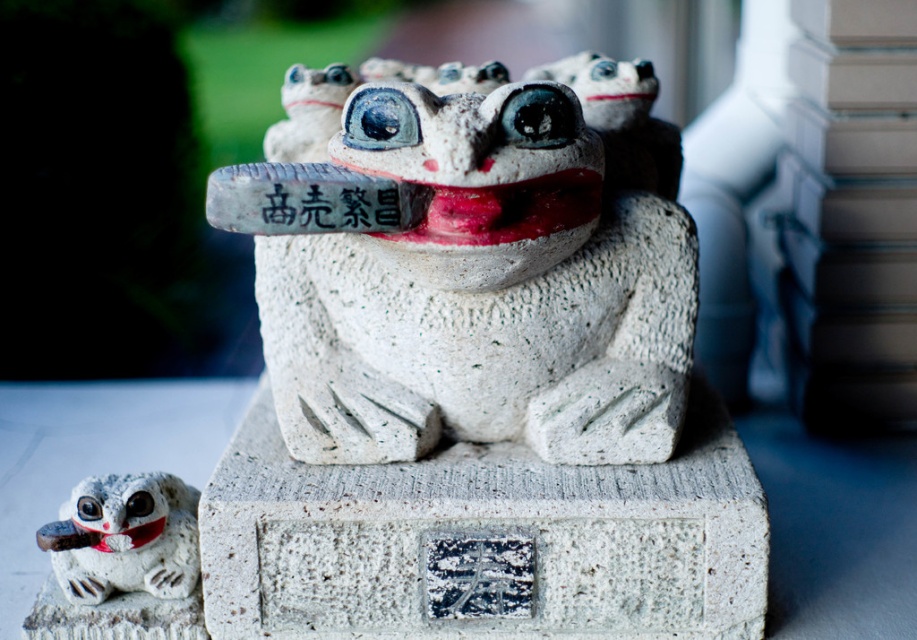
You are an art curator planning to display both the white stone frog at center and the white stone frog at lower left in a new exhibition. Which frog should be placed closer to the entrance to ensure visitors notice its larger size first?

The white stone frog at center should be placed closer to the entrance because it is larger in size than the white stone frog at lower left, making it more noticeable to visitors upon entry.

You are standing in front of the main frog statue and want to place a small bird figurine between the white stone frog at center and the white stone frog at lower left. Can you do this without the bird being blocked from view by either frog?

The white stone frog at center is closer to the viewer than the white stone frog at lower left. Therefore, placing the bird between them would require positioning it behind the closer frog, which would block the view. Alternatively, placing it in front of the closer frog might not be possible due to the frog being in front. Hence, the bird figurine would likely be blocked by the closer frog, making it impossible to place it between them without obstruction.

What is the object located at the coordinates point (x=484, y=285) in the image?

The point (x=484, y=285) marks the white stone frog at center.